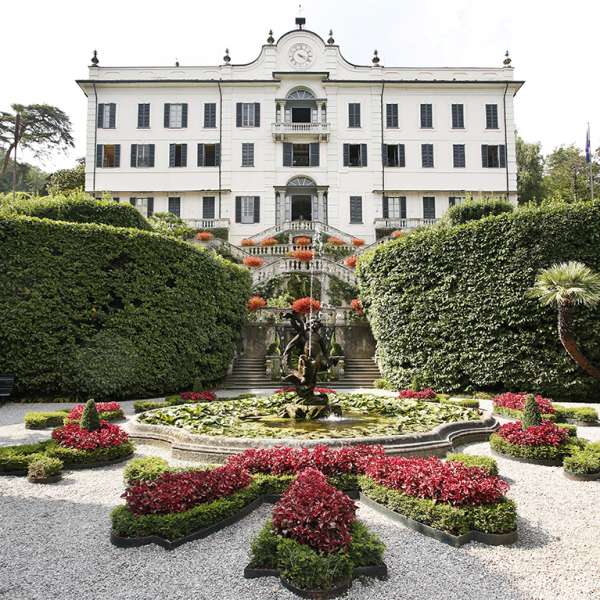
This screenshot has height=600, width=600. What are the coordinates of `orange flowers` in the screenshot? It's located at (304, 299), (255, 304), (298, 247), (250, 264), (350, 258), (355, 238), (297, 234), (248, 238).